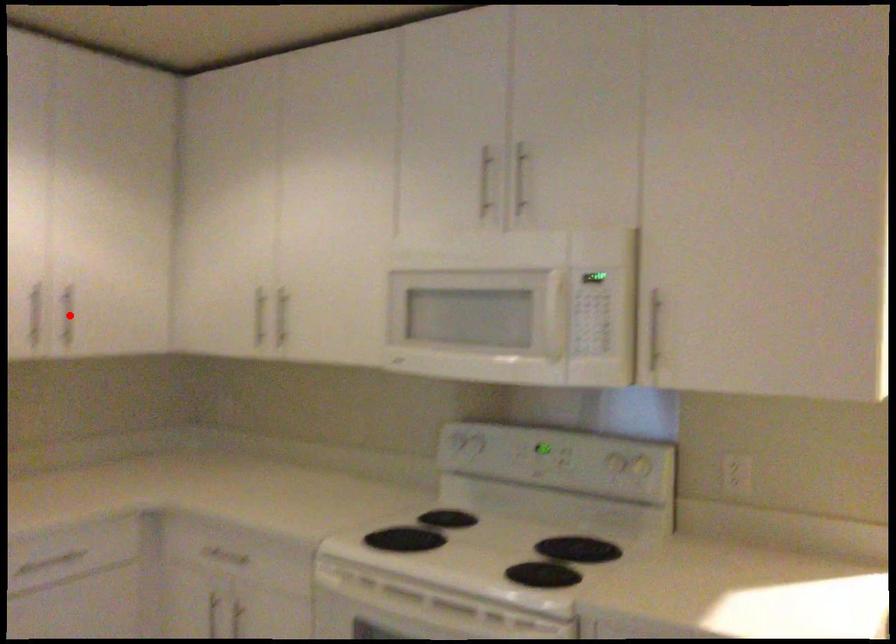
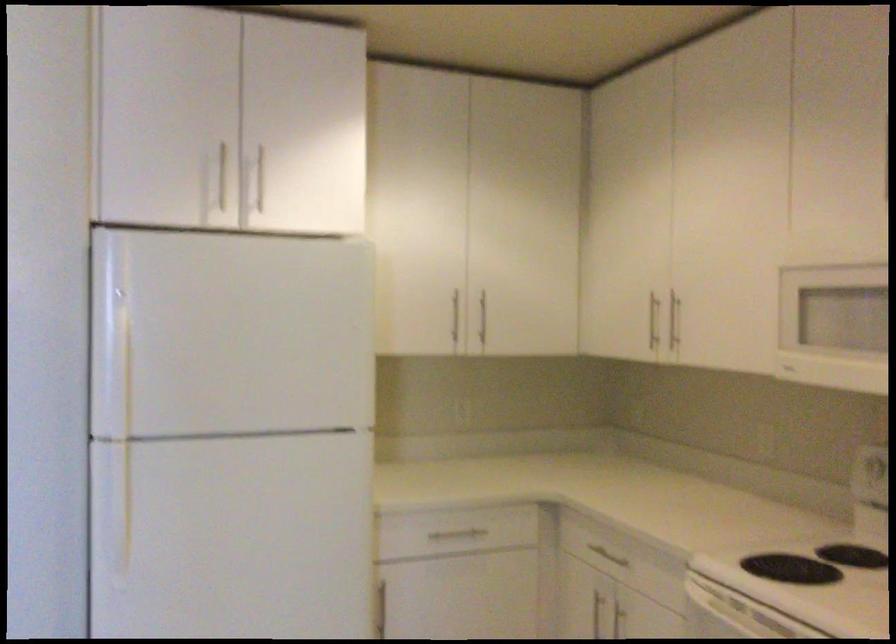
Where in the second image is the point corresponding to the highlighted location from the first image?

(483, 317)